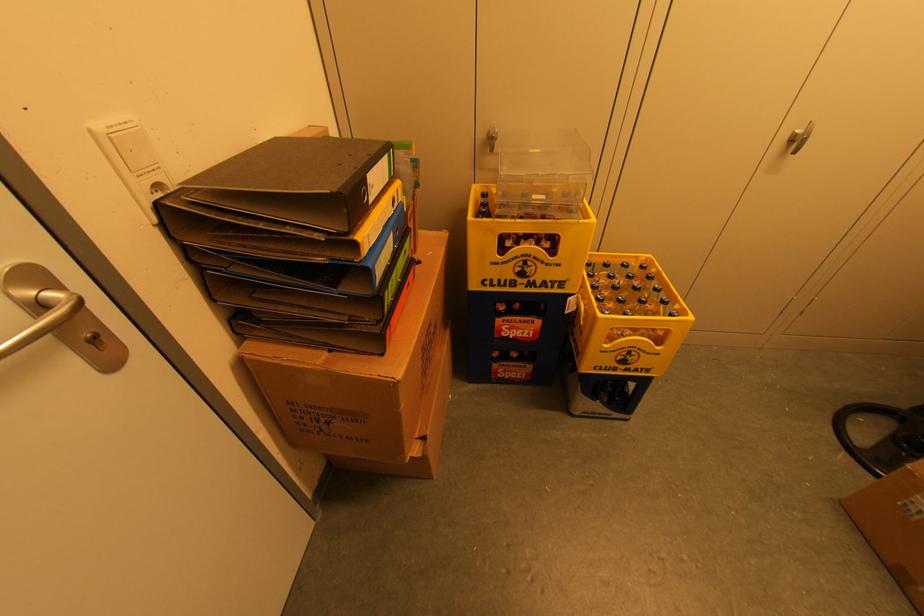
This screenshot has height=616, width=924. What do you see at coordinates (62, 315) in the screenshot?
I see `the metal door handle` at bounding box center [62, 315].